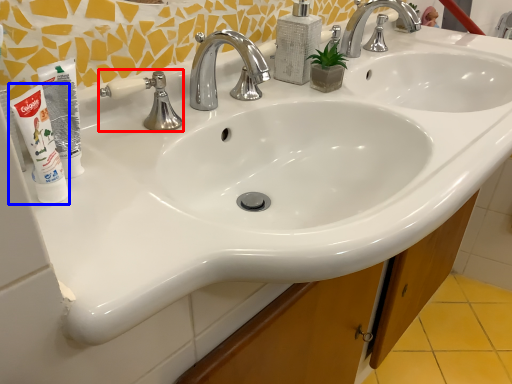
Question: Among these objects, which one is farthest to the camera, plumbing fixture (highlighted by a red box) or shaving cream (highlighted by a blue box)?

Choices:
 (A) plumbing fixture
 (B) shaving cream

Answer: (A)